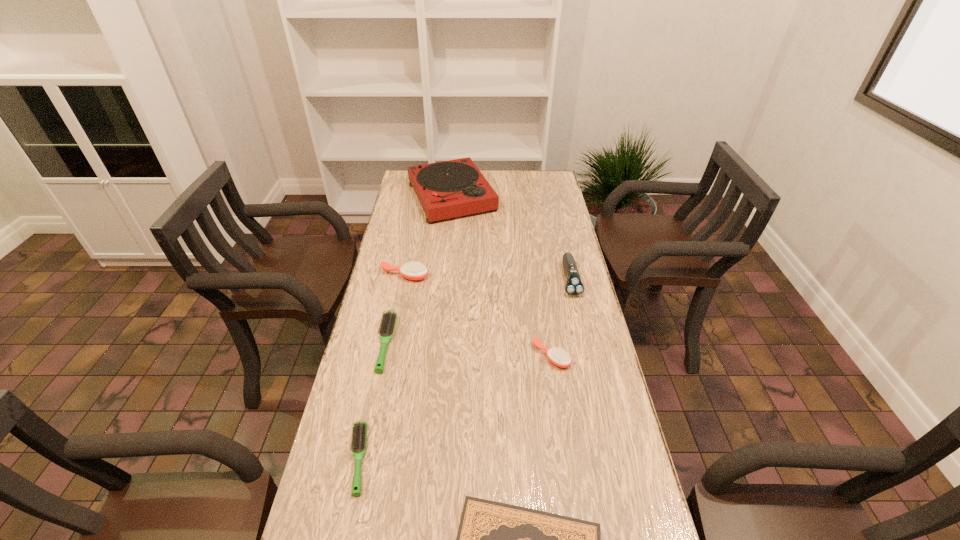
The height and width of the screenshot is (540, 960). I want to click on vacant area that lies between the farther light hairbrush and the tallest hairbrush, so click(396, 309).

The height and width of the screenshot is (540, 960). In order to click on the sixth closest object relative to the nearest object in this screenshot , I will do `click(453, 188)`.

Identify which object is the third closest to the nearest object. Please provide its 2D coordinates. Your answer should be formatted as a tuple, i.e. [(x, y)], where the tuple contains the x and y coordinates of a point satisfying the conditions above.

[(388, 322)]

Select which hairbrush is the third closest to the electric shaver. Please provide its 2D coordinates. Your answer should be formatted as a tuple, i.e. [(x, y)], where the tuple contains the x and y coordinates of a point satisfying the conditions above.

[(388, 322)]

Point out which hairbrush is positioned as the third nearest to the sixth farthest object. Please provide its 2D coordinates. Your answer should be formatted as a tuple, i.e. [(x, y)], where the tuple contains the x and y coordinates of a point satisfying the conditions above.

[(414, 270)]

Identify the location of light hairbrush object that ranks as the closest to the hardback book. The image size is (960, 540). (359, 437).

Identify which light hairbrush is the second nearest to the smaller orange hairbrush. Please provide its 2D coordinates. Your answer should be formatted as a tuple, i.e. [(x, y)], where the tuple contains the x and y coordinates of a point satisfying the conditions above.

[(359, 437)]

In order to click on free spot that satisfies the following two spatial constraints: 1. on the back side of the farther light hairbrush; 2. on the left side of the red record player in this screenshot , I will do `click(417, 197)`.

Locate an element on the screen. This screenshot has width=960, height=540. vacant space that satisfies the following two spatial constraints: 1. on the back side of the sixth farthest object; 2. on the right side of the right orange hairbrush is located at coordinates (380, 356).

I want to click on free space in the image that satisfies the following two spatial constraints: 1. on the back side of the nearer light hairbrush; 2. on the left side of the right orange hairbrush, so [380, 356].